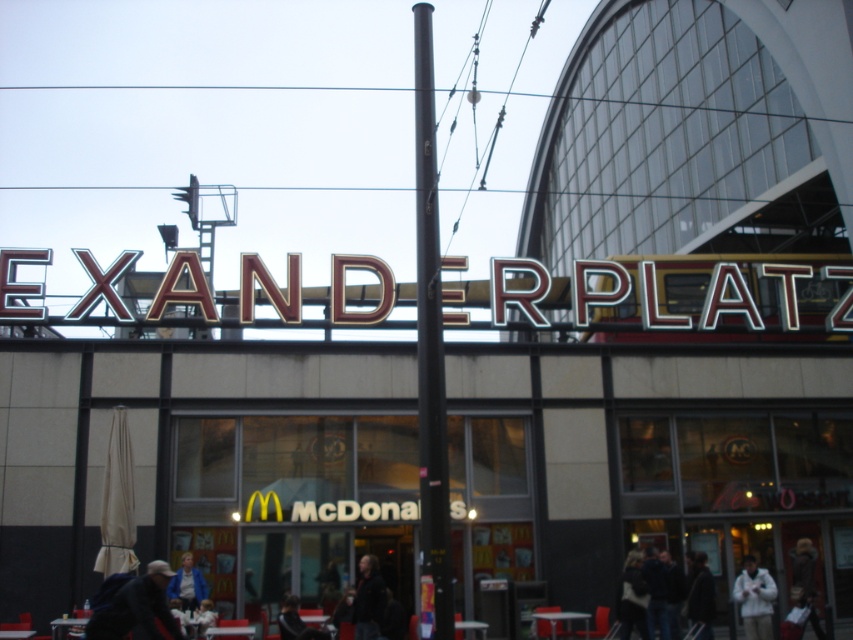
Looking at this image, you are a photographer standing in front of the McDonalds at Alexanderplatz. You notice two jackets in the scene. The first is a dark blue jacket at lower right, and the second is a blue fabric jacket at center. Which jacket would appear larger in your photo?

The dark blue jacket at lower right appears larger in the photo because it is bigger than the blue fabric jacket at center.

You are standing in front of the McDonalds at Alexanderplatz. You see a person with dark hair at center and a dark brown fur coat at lower right. Which object is closer to you?

The dark hair at center is closer to the viewer than the dark brown fur coat at lower right.

You are a photographer standing at the entrance of the McDonalds at Alexanderplatz. You notice a person with dark hair at center and a person wearing a dark brown fur coat at lower right. Which of these two people is closer to you?

The dark brown fur coat at lower right is closer to you because it is positioned at lower right, which is typically closer to the viewer in such scenes.